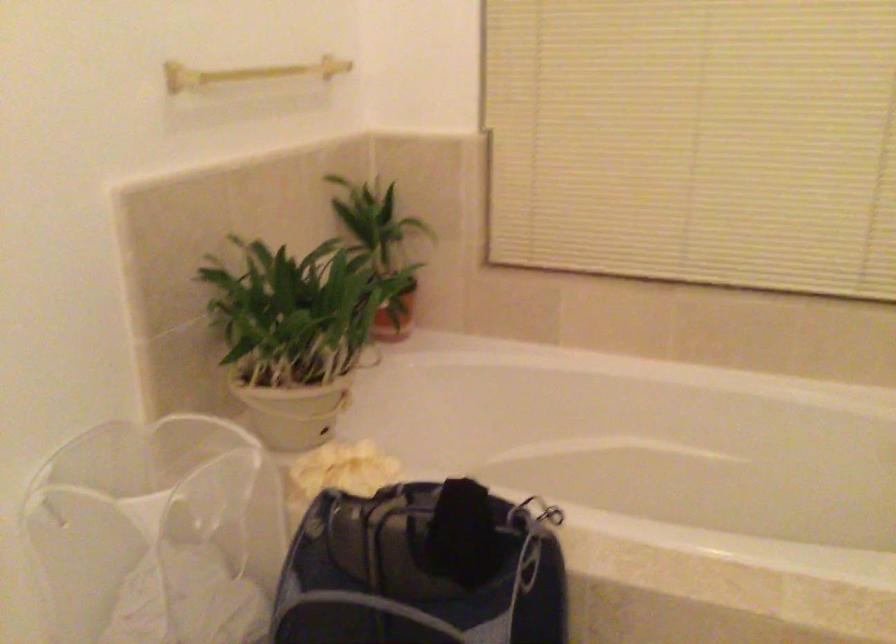
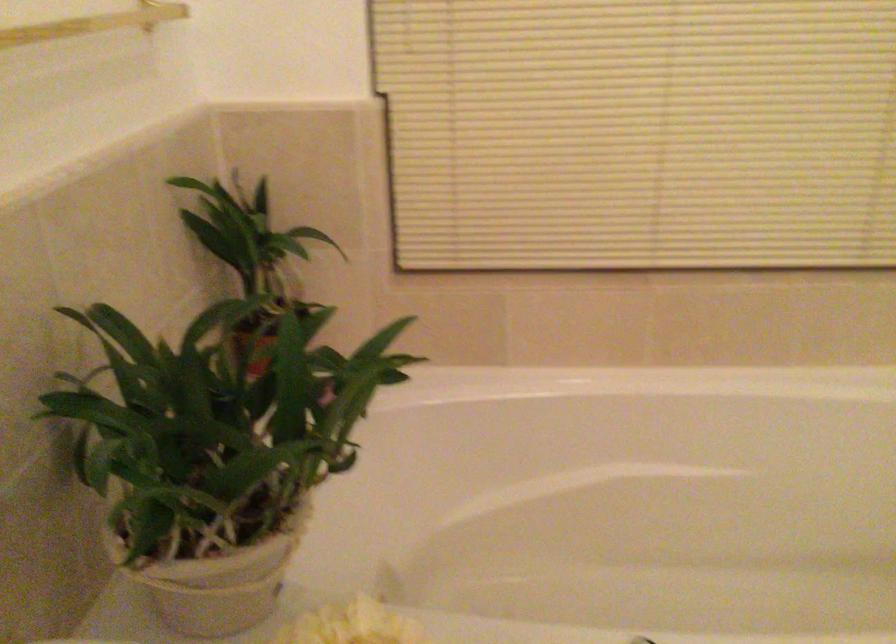
In the second image, find the point that corresponds to pixel 282 408 in the first image.

(218, 579)